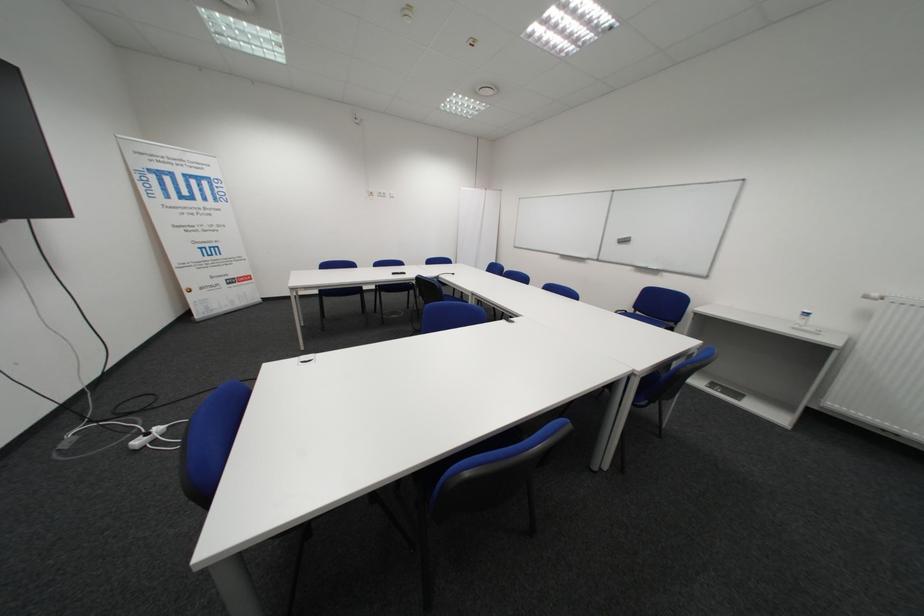
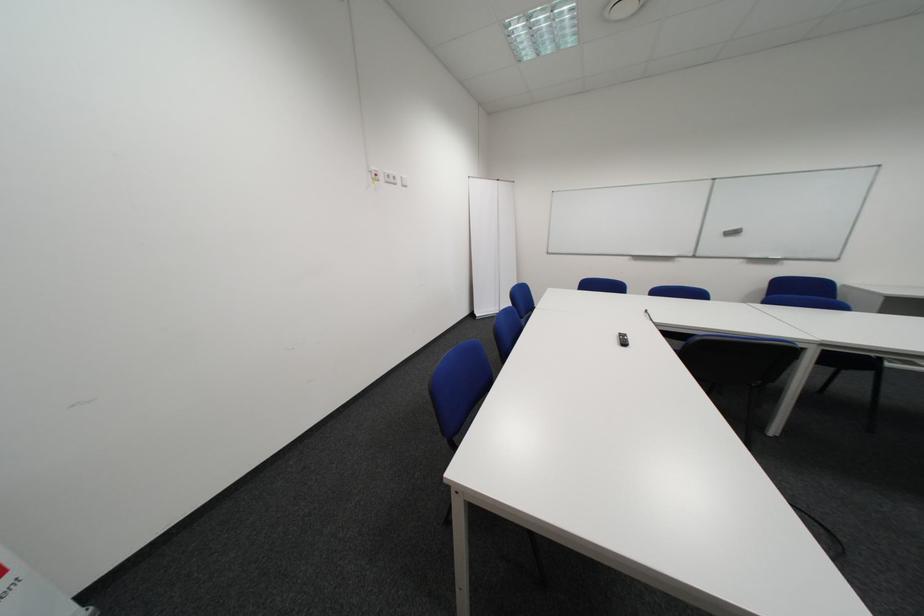
Find the pixel in the second image that matches pixel 396 195 in the first image.

(407, 179)